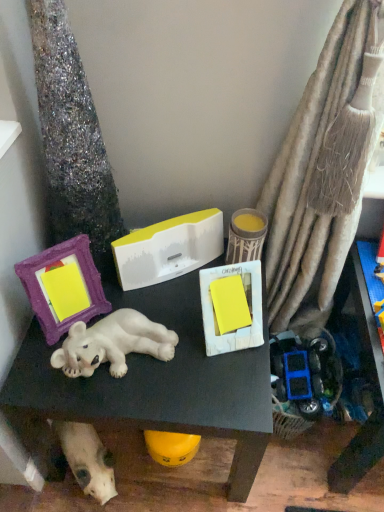
This screenshot has width=384, height=512. In order to click on vacant area on top of white glossy polar bear at center (from a real-world perspective) in this screenshot , I will do `click(168, 327)`.